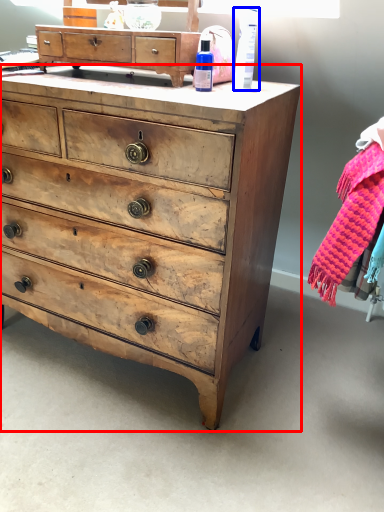
Question: Which object appears farthest to the camera in this image, chest of drawers (highlighted by a red box) or toiletry (highlighted by a blue box)?

Choices:
 (A) chest of drawers
 (B) toiletry

Answer: (B)